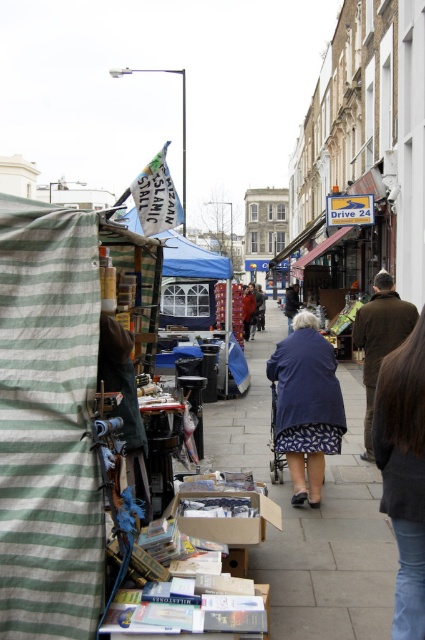
Where is `blue fabric at center`? The width and height of the screenshot is (425, 640). blue fabric at center is located at coordinates (306, 404).

Which is behind, point (289, 408) or point (370, 445)?

The point (370, 445) is more distant.

Between point (325, 429) and point (371, 394), which one is positioned in front?

Point (325, 429) is more forward.

The width and height of the screenshot is (425, 640). Identify the location of blue fabric at center. (306, 404).

Is blue fabric at center thinner than blue fabric jacket at center?

No.

Identify the location of blue fabric at center. This screenshot has width=425, height=640. (306, 404).

Between point (363, 369) and point (246, 298), which one is positioned in front?

Positioned in front is point (363, 369).

Who is lower down, brown leather jacket at right or blue fabric jacket at center?

Positioned lower is brown leather jacket at right.

Between point (374, 307) and point (252, 301), which one is positioned in front?

Point (374, 307) is more forward.

At what (x,y) coordinates should I click in order to perform the action: click on brown leather jacket at right. Please return your answer as a coordinate pair (x, y). The height and width of the screenshot is (640, 425). Looking at the image, I should click on (379, 339).